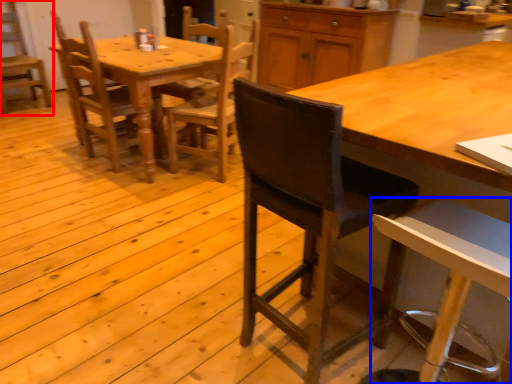
Question: Which object is further to the camera taking this photo, chair (highlighted by a red box) or chair (highlighted by a blue box)?

Choices:
 (A) chair
 (B) chair

Answer: (A)